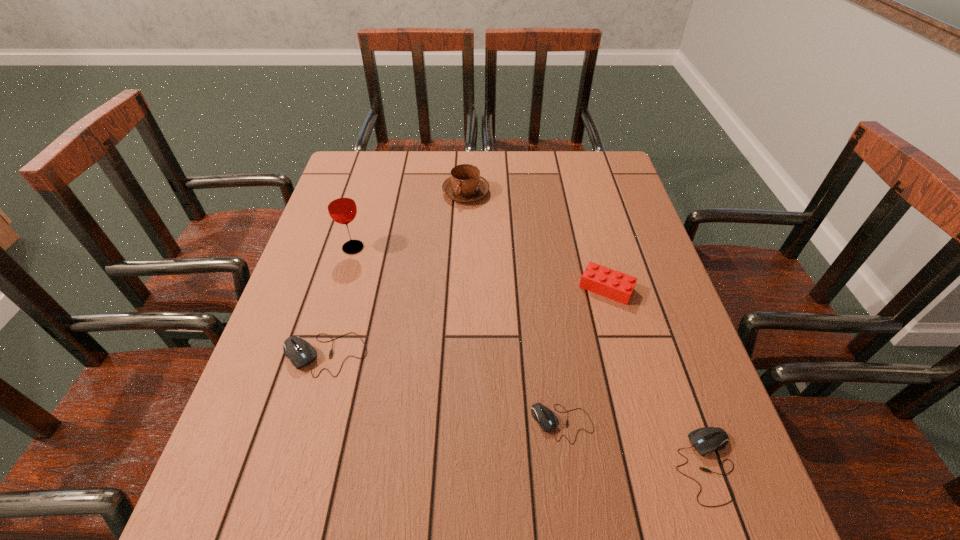
Where is `blank region between the tallest object and the third nearest object`? The image size is (960, 540). blank region between the tallest object and the third nearest object is located at coordinates (339, 301).

Where is `blank region between the glass and the leftmost computer mouse`? This screenshot has height=540, width=960. blank region between the glass and the leftmost computer mouse is located at coordinates coord(339,301).

This screenshot has width=960, height=540. I want to click on unoccupied area between the second shortest computer mouse and the leftmost computer mouse, so click(x=516, y=410).

The image size is (960, 540). What are the coordinates of `free space between the cappuccino and the shortest computer mouse` in the screenshot? It's located at (515, 308).

I want to click on vacant area that lies between the third shortest object and the tallest object, so click(339, 301).

Locate an element on the screen. blank region between the tallest object and the second shortest object is located at coordinates (530, 356).

At what (x,y) coordinates should I click in order to perform the action: click on vacant area that lies between the tallest object and the fourth nearest object. Please return your answer as a coordinate pair (x, y). Looking at the image, I should click on (480, 268).

This screenshot has height=540, width=960. Identify the location of free spot between the second computer mouse from right to left and the cappuccino. (515, 308).

Identify the location of vacant area that lies between the third object from right to left and the farthest object. This screenshot has width=960, height=540. (515, 308).

What are the coordinates of `object that ranks as the third closest to the farthest object` in the screenshot? It's located at (300, 352).